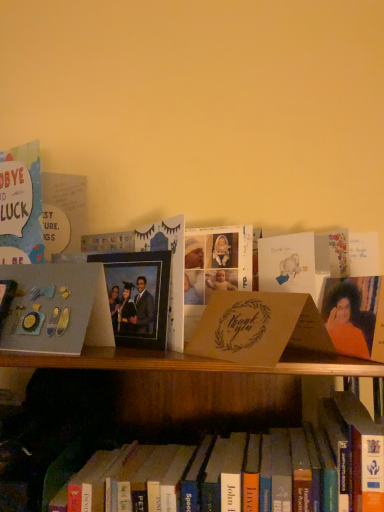
Question: From a real-world perspective, is matte gray paper at left, the 3th paperback book from the right, physically above matte brown card at center, which appears as the first paperback book when viewed from the right?

Choices:
 (A) no
 (B) yes

Answer: (A)

Question: Is matte gray paper at left, the 1th paperback book viewed from the left, to the left of matte brown card at center, the third paperback book positioned from the left, from the viewer's perspective?

Choices:
 (A) yes
 (B) no

Answer: (A)

Question: Is matte gray paper at left, the 1th paperback book viewed from the left, to the right of matte brown card at center, the third paperback book positioned from the left, from the viewer's perspective?

Choices:
 (A) yes
 (B) no

Answer: (B)

Question: Does matte gray paper at left, the 3th paperback book from the right, turn towards matte brown card at center, the third paperback book positioned from the left?

Choices:
 (A) no
 (B) yes

Answer: (A)

Question: From a real-world perspective, is matte gray paper at left, the 1th paperback book viewed from the left, physically below matte brown card at center, the third paperback book positioned from the left?

Choices:
 (A) yes
 (B) no

Answer: (A)

Question: In the image, is matte black photo frame at center on the left side or the right side of orange fabric portrait at right?

Choices:
 (A) right
 (B) left

Answer: (B)

Question: In terms of width, does matte black photo frame at center look wider or thinner when compared to orange fabric portrait at right?

Choices:
 (A) thin
 (B) wide

Answer: (A)

Question: Choose the correct answer: Is matte black photo frame at center inside orange fabric portrait at right or outside it?

Choices:
 (A) outside
 (B) inside

Answer: (A)

Question: From a real-world perspective, is matte black photo frame at center physically located above or below orange fabric portrait at right?

Choices:
 (A) below
 (B) above

Answer: (B)

Question: From a real-world perspective, is matte brown card at center, the 2th paperback book when ordered from right to left, physically located above or below orange fabric portrait at right?

Choices:
 (A) below
 (B) above

Answer: (A)

Question: Choose the correct answer: Is matte brown card at center, placed as the 2th paperback book when sorted from left to right, inside orange fabric portrait at right or outside it?

Choices:
 (A) outside
 (B) inside

Answer: (A)

Question: Considering the positions of matte brown card at center, placed as the 2th paperback book when sorted from left to right, and orange fabric portrait at right in the image, is matte brown card at center, placed as the 2th paperback book when sorted from left to right, wider or thinner than orange fabric portrait at right?

Choices:
 (A) thin
 (B) wide

Answer: (B)

Question: Considering the positions of matte brown card at center, the 2th paperback book when ordered from right to left, and orange fabric portrait at right in the image, is matte brown card at center, the 2th paperback book when ordered from right to left, taller or shorter than orange fabric portrait at right?

Choices:
 (A) short
 (B) tall

Answer: (A)

Question: Visually, is matte brown card at center, placed as the 2th paperback book when sorted from left to right, positioned to the left or to the right of matte gray paper at left, the 1th paperback book viewed from the left?

Choices:
 (A) left
 (B) right

Answer: (B)

Question: Is matte brown card at center, placed as the 2th paperback book when sorted from left to right, bigger or smaller than matte gray paper at left, the 1th paperback book viewed from the left?

Choices:
 (A) small
 (B) big

Answer: (A)